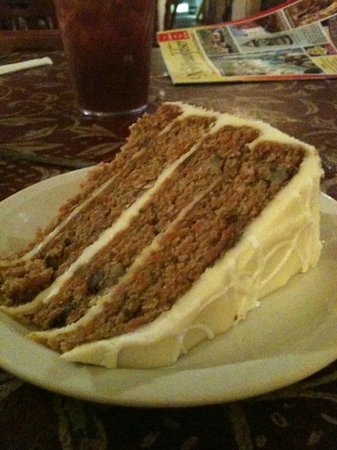
Locate an element on the screen. white plate is located at coordinates (221, 377).